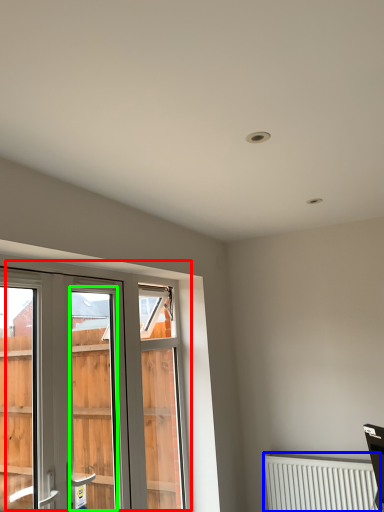
Question: Which object is the farthest from window (highlighted by a red box)? Choose among these: radiator (highlighted by a blue box) or screen door (highlighted by a green box).

Choices:
 (A) radiator
 (B) screen door

Answer: (B)